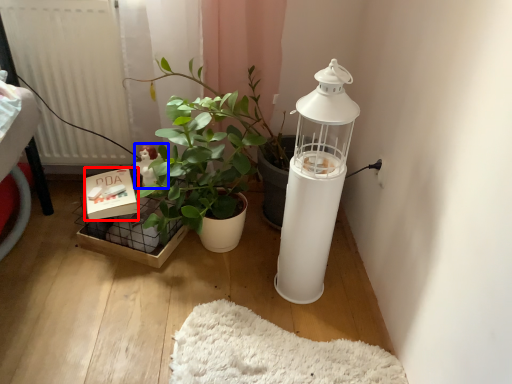
Question: Among these objects, which one is nearest to the camera, box (highlighted by a red box) or toy (highlighted by a blue box)?

Choices:
 (A) box
 (B) toy

Answer: (A)